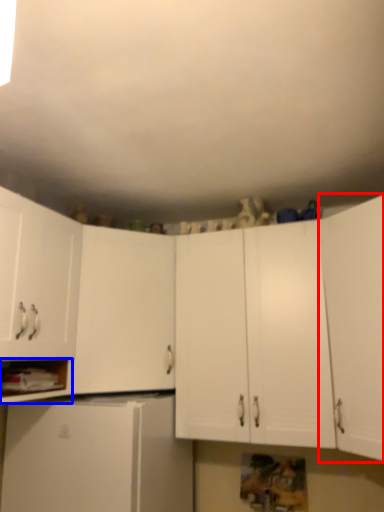
Question: Among these objects, which one is nearest to the camera, cabinetry (highlighted by a red box) or cabinet (highlighted by a blue box)?

Choices:
 (A) cabinetry
 (B) cabinet

Answer: (A)